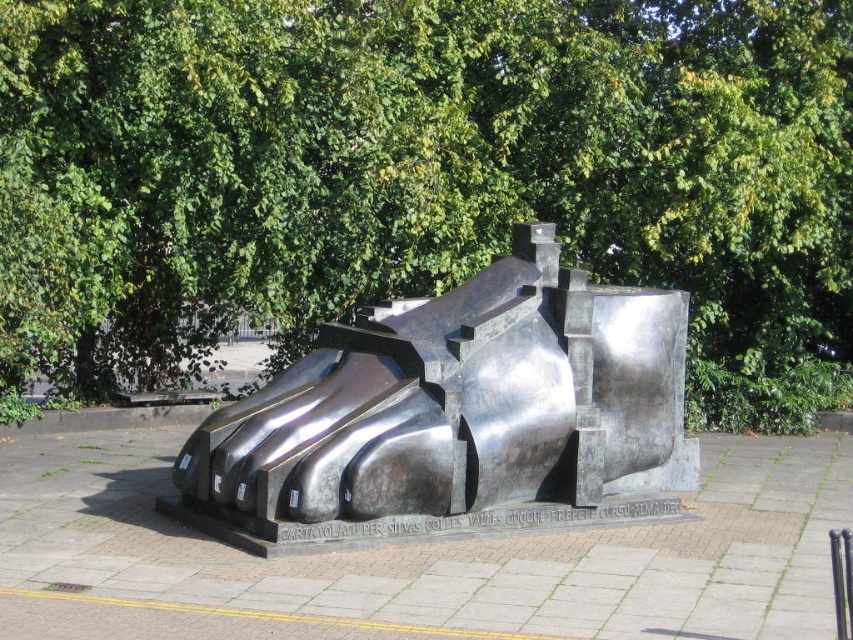
Question: Is green leafy tree at upper center wider than polished bronze sculpture at center?

Choices:
 (A) no
 (B) yes

Answer: (B)

Question: Which point appears farthest from the camera in this image?

Choices:
 (A) (369, 426)
 (B) (422, 250)

Answer: (B)

Question: Can you confirm if green leafy tree at upper center is positioned above polished bronze sculpture at center?

Choices:
 (A) yes
 (B) no

Answer: (A)

Question: Does green leafy tree at upper center appear over polished bronze sculpture at center?

Choices:
 (A) yes
 (B) no

Answer: (A)

Question: Which point appears closest to the camera in this image?

Choices:
 (A) (418, 408)
 (B) (33, 134)

Answer: (A)